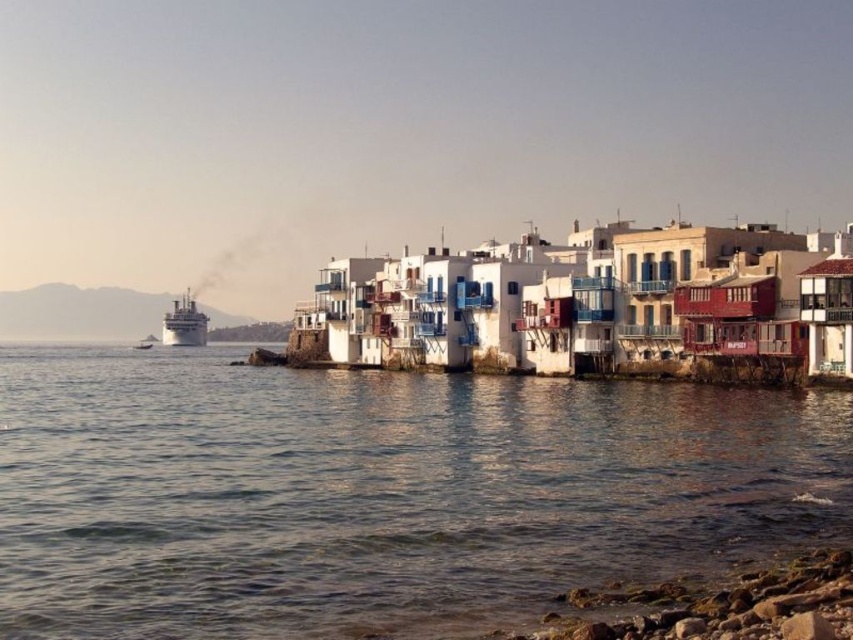
Describe the element at coordinates (379, 492) in the screenshot. I see `clear water at lower left` at that location.

Is the position of clear water at lower left more distant than that of shiny silver cruise ship at left?

That is False.

Who is more distant from viewer, (16,456) or (166,321)?

The point (166,321) is behind.

I want to click on clear water at lower left, so click(379, 492).

Does white painted wood houses at center appear over shiny silver cruise ship at left?

Yes.

Can you confirm if white painted wood houses at center is wider than shiny silver cruise ship at left?

Yes.

Who is more forward, (346, 364) or (193, 336)?

Point (346, 364)

Find the location of `white painted wood houses at center`. white painted wood houses at center is located at coordinates (596, 305).

Which is below, clear water at lower left or white painted wood houses at center?

clear water at lower left

Between clear water at lower left and white painted wood houses at center, which one appears on the right side from the viewer's perspective?

From the viewer's perspective, white painted wood houses at center appears more on the right side.

This screenshot has width=853, height=640. Identify the location of clear water at lower left. (379, 492).